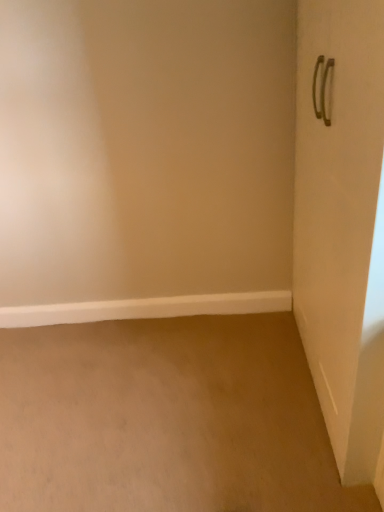
Question: From the image's perspective, is metallic silver handle at right above white smooth baseboard at lower left?

Choices:
 (A) yes
 (B) no

Answer: (A)

Question: Considering the relative positions of metallic silver handle at right and white smooth baseboard at lower left in the image provided, is metallic silver handle at right to the left of white smooth baseboard at lower left from the viewer's perspective?

Choices:
 (A) no
 (B) yes

Answer: (A)

Question: Can you confirm if metallic silver handle at right is shorter than white smooth baseboard at lower left?

Choices:
 (A) no
 (B) yes

Answer: (A)

Question: Is metallic silver handle at right thinner than white smooth baseboard at lower left?

Choices:
 (A) yes
 (B) no

Answer: (B)

Question: Is the position of metallic silver handle at right more distant than that of white smooth baseboard at lower left?

Choices:
 (A) yes
 (B) no

Answer: (B)

Question: Does metallic silver handle at right have a larger size compared to white smooth baseboard at lower left?

Choices:
 (A) yes
 (B) no

Answer: (A)

Question: Is white smooth baseboard at lower left to the right of metallic silver handle at right from the viewer's perspective?

Choices:
 (A) no
 (B) yes

Answer: (A)

Question: Is white smooth baseboard at lower left beside metallic silver handle at right?

Choices:
 (A) no
 (B) yes

Answer: (A)

Question: Can we say white smooth baseboard at lower left lies outside metallic silver handle at right?

Choices:
 (A) no
 (B) yes

Answer: (B)

Question: Does white smooth baseboard at lower left have a greater width compared to metallic silver handle at right?

Choices:
 (A) yes
 (B) no

Answer: (B)

Question: Would you say metallic silver handle at right is part of white smooth baseboard at lower left's contents?

Choices:
 (A) no
 (B) yes

Answer: (A)

Question: Can you confirm if white smooth baseboard at lower left is smaller than metallic silver handle at right?

Choices:
 (A) no
 (B) yes

Answer: (B)

Question: Is metallic silver handle at right wider or thinner than white smooth baseboard at lower left?

Choices:
 (A) wide
 (B) thin

Answer: (A)